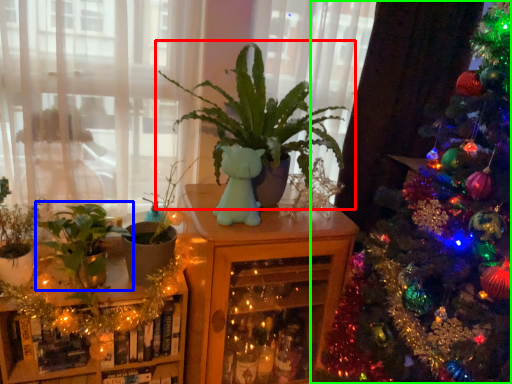
Question: Which is farther away from houseplant (highlighted by a red box)? houseplant (highlighted by a blue box) or christmas tree (highlighted by a green box)?

Choices:
 (A) houseplant
 (B) christmas tree

Answer: (A)